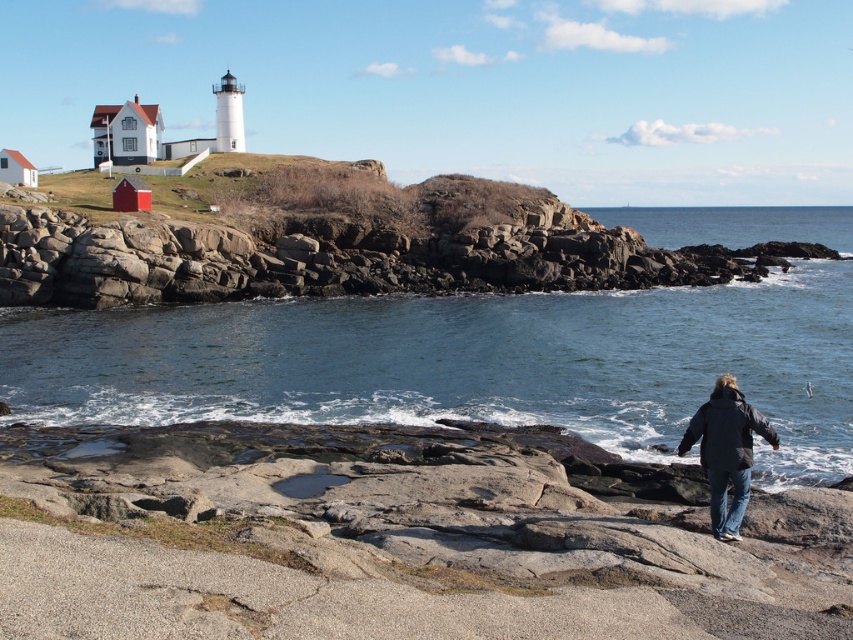
You are a photographer planning to capture the entire scene in one shot. Given that the clear blue water at center and the rocky at upper left are both in the frame, which object will occupy a larger portion of the photo?

The clear blue water at center will occupy a larger portion of the photo since it is bigger than the rocky at upper left according to the description.

You are standing on the rocky shoreline and notice the clear blue water at center and the dark blue jacket at lower right. Which object takes up more space in the image?

The clear blue water at center takes up more space in the image than the dark blue jacket at lower right because it is bigger.